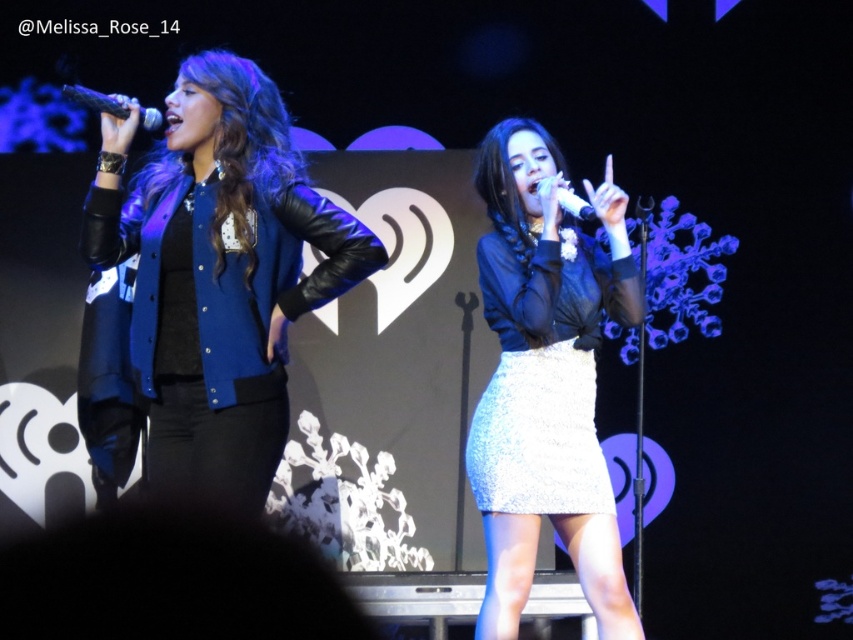
Who is lower down, satin white skirt at center or matte black microphone at center?

satin white skirt at center is below.

Is satin white skirt at center positioned behind matte black microphone at center?

Yes.

Between point (502, 186) and point (575, 198), which one is positioned in front?

Point (575, 198)

This screenshot has height=640, width=853. Find the location of `satin white skirt at center`. satin white skirt at center is located at coordinates (546, 380).

How far apart are matte blue leather jacket at left and matte black microphone at center?

3.43 feet

Which is more to the left, matte blue leather jacket at left or matte black microphone at center?

matte blue leather jacket at left

Is point (270, 93) farther from camera compared to point (579, 202)?

No, (270, 93) is closer to viewer.

This screenshot has height=640, width=853. Identify the location of matte blue leather jacket at left. (218, 273).

Between satin white skirt at center and black matte microphone at upper left, which one is positioned lower?

Positioned lower is satin white skirt at center.

Can you confirm if satin white skirt at center is positioned to the left of black matte microphone at upper left?

Incorrect, satin white skirt at center is not on the left side of black matte microphone at upper left.

Does point (570, 552) come in front of point (119, 115)?

No, it is behind (119, 115).

I want to click on satin white skirt at center, so click(546, 380).